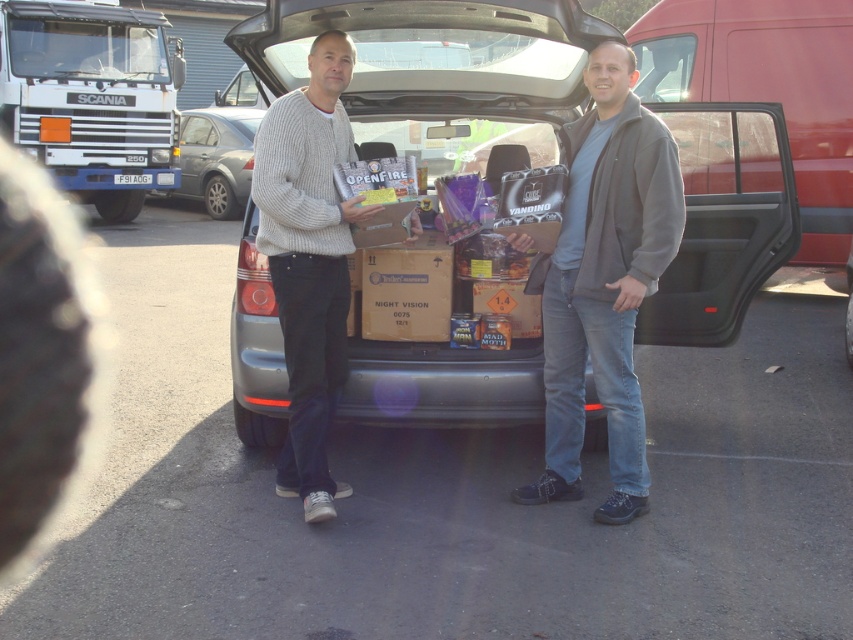
Between metallic gray car at center and white matte truck at upper left, which one is positioned higher?

white matte truck at upper left is above.

Is metallic gray car at center positioned at the back of white matte truck at upper left?

No, it is in front of white matte truck at upper left.

The image size is (853, 640). What do you see at coordinates (442, 72) in the screenshot? I see `metallic gray car at center` at bounding box center [442, 72].

This screenshot has width=853, height=640. What are the coordinates of `metallic gray car at center` in the screenshot? It's located at (442, 72).

Does point (270, 51) come in front of point (207, 195)?

Yes, point (270, 51) is in front of point (207, 195).

Based on the photo, is metallic gray car at center further to the viewer compared to metallic silver sedan at center?

No, it is not.

Is point (451, 385) positioned in front of point (259, 116)?

Yes, it is.

Locate an element on the screen. The height and width of the screenshot is (640, 853). metallic gray car at center is located at coordinates (442, 72).

Can you confirm if white matte truck at upper left is smaller than metallic silver sedan at center?

Incorrect, white matte truck at upper left is not smaller in size than metallic silver sedan at center.

Which is more to the right, white matte truck at upper left or metallic silver sedan at center?

From the viewer's perspective, metallic silver sedan at center appears more on the right side.

The image size is (853, 640). Describe the element at coordinates (90, 97) in the screenshot. I see `white matte truck at upper left` at that location.

Where is `white matte truck at upper left`? This screenshot has width=853, height=640. white matte truck at upper left is located at coordinates (90, 97).